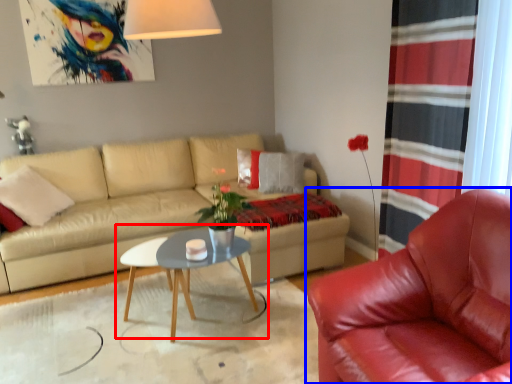
Question: Among these objects, which one is nearest to the camera, coffee table (highlighted by a red box) or chair (highlighted by a blue box)?

Choices:
 (A) coffee table
 (B) chair

Answer: (B)